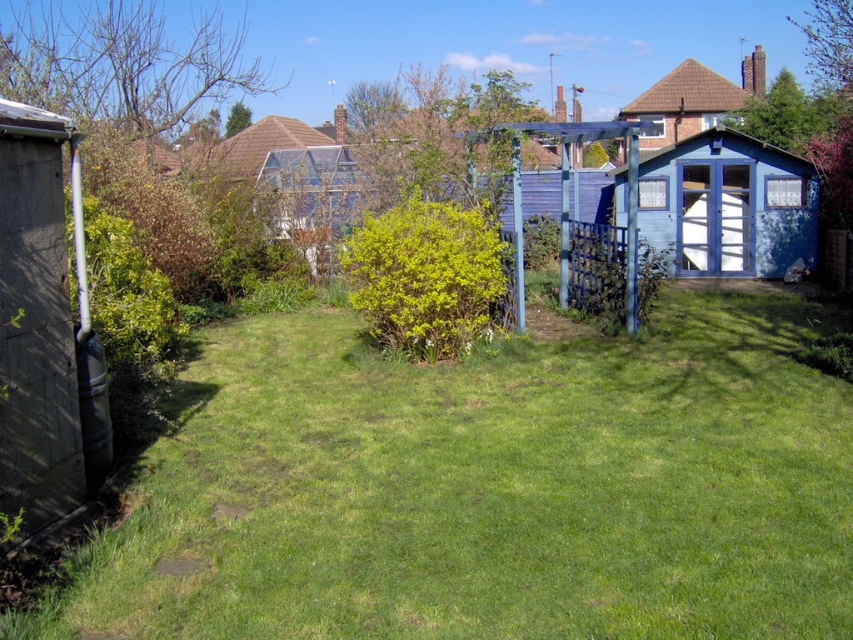
Which is behind, point (654, 248) or point (250, 163)?

Positioned behind is point (250, 163).

Does blue painted wood shed at right have a greater height compared to brown tiled roof at upper center?

No, blue painted wood shed at right is not taller than brown tiled roof at upper center.

Who is more distant from viewer, [741,132] or [308,125]?

Positioned behind is point [308,125].

The height and width of the screenshot is (640, 853). In order to click on blue painted wood shed at right in this screenshot , I will do `click(728, 205)`.

Who is taller, green grass at center or brown tiled roof at upper center?

Standing taller between the two is brown tiled roof at upper center.

This screenshot has width=853, height=640. In order to click on green grass at center in this screenshot , I will do (x=486, y=488).

Is point (109, 529) farther from viewer compared to point (198, 157)?

No, (109, 529) is in front of (198, 157).

Identify the location of green grass at center. (486, 488).

From the picture: Can you confirm if green grass at center is positioned above blue wooden shed at upper right?

No, green grass at center is not above blue wooden shed at upper right.

Does point (292, 397) come farther from viewer compared to point (643, 132)?

No, it is not.

The image size is (853, 640). What do you see at coordinates (486, 488) in the screenshot? I see `green grass at center` at bounding box center [486, 488].

The image size is (853, 640). I want to click on green grass at center, so click(486, 488).